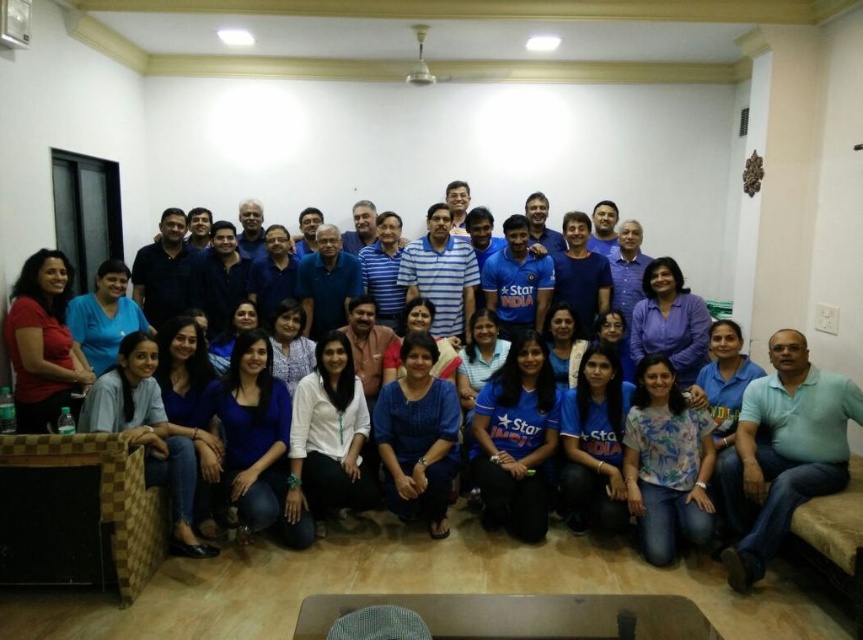
You are a photographer standing at the center of the room. You need to adjust the camera focus to capture both the light blue cotton shirt at lower right and the matte red shirt at lower left clearly. Given that the camera has a depth of field that can cover 3 meters, will both shirts be in focus?

The light blue cotton shirt at lower right is 3.63 meters away from the matte red shirt at lower left. Since the distance between them exceeds the camera depth of field of 3 meters, both shirts may not be in focus simultaneously.

You are a photographer taking a photo of the group. You notice two points in the image at coordinates point (x=786, y=448) and point (x=67, y=362). Which point should you focus on to ensure the foreground is sharp?

You should focus on point (x=786, y=448) because it is closer to the camera than point (x=67, y=362), ensuring the foreground remains sharp.

You are a photographer trying to adjust the lighting for a group photo. You notice the light blue cotton shirt at lower right and the matte red shirt at lower left. Which shirt might require more attention to avoid overexposure due to its color and size? Explain your reasoning.

The light blue cotton shirt at lower right is larger in size than the matte red shirt at lower left. Since larger and lighter colored objects can reflect more light, the light blue cotton shirt at lower right may require more attention to avoid overexposure.